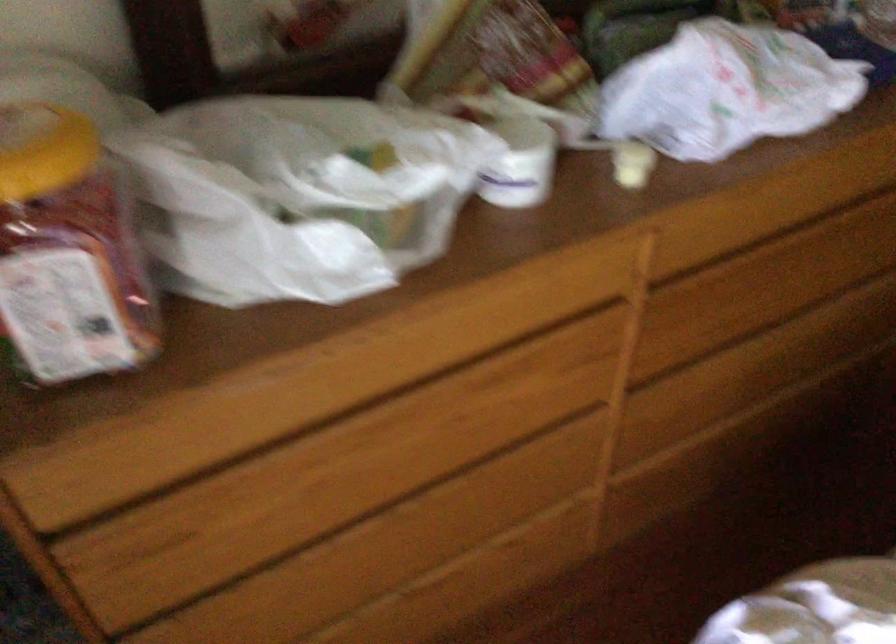
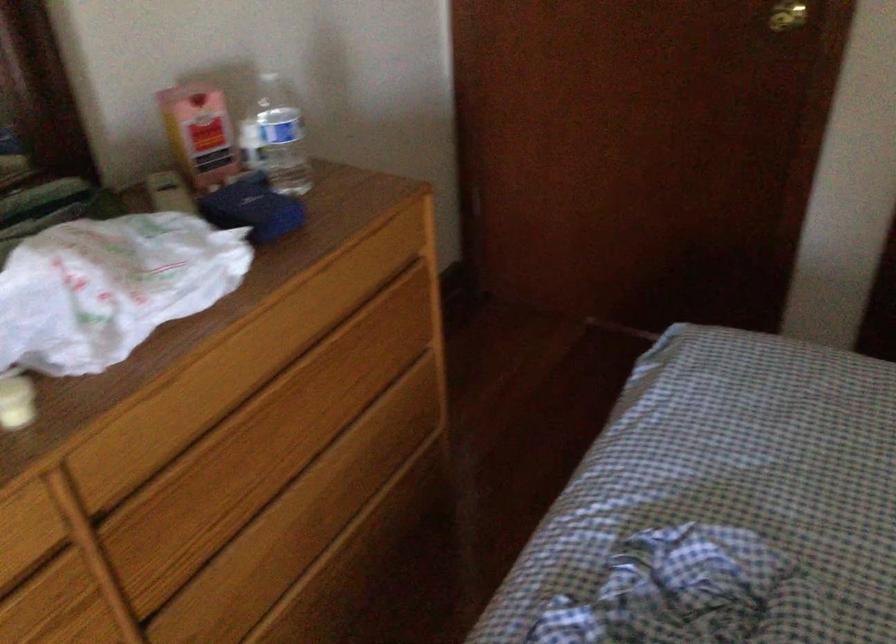
Question: Based on the continuous images, in which direction is the camera rotating? Reply with the corresponding letter.

Choices:
 (A) Left
 (B) Right
 (C) Up
 (D) Down

Answer: (B)